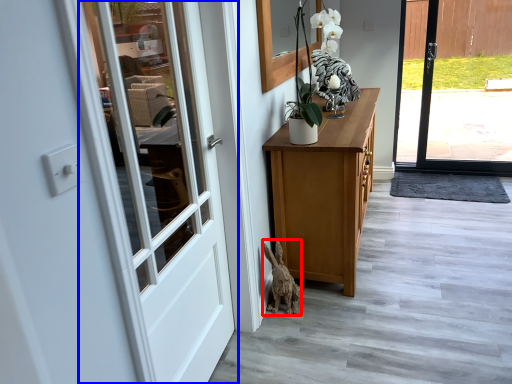
Question: Which of the following is the closest to the observer, animal (highlighted by a red box) or door (highlighted by a blue box)?

Choices:
 (A) animal
 (B) door

Answer: (B)